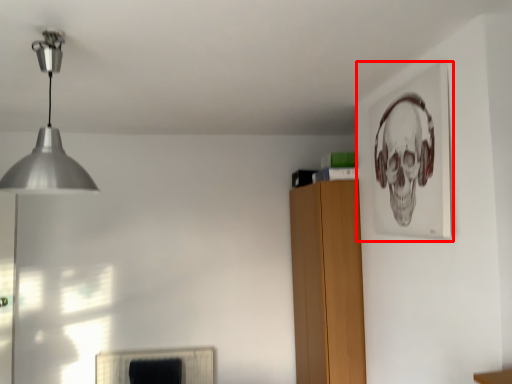
Question: Considering the relative positions of picture frame (annotated by the red box) and lamp in the image provided, where is picture frame (annotated by the red box) located with respect to the staircase?

Choices:
 (A) left
 (B) right

Answer: (B)